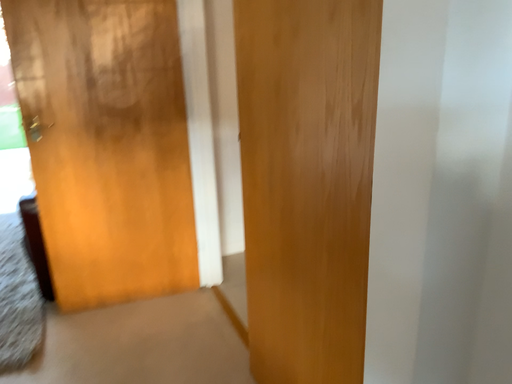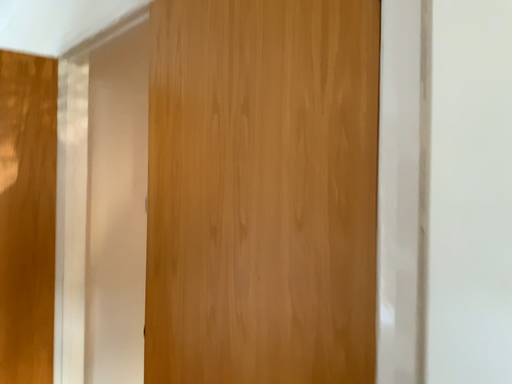
Question: How did the camera likely rotate when shooting the video?

Choices:
 (A) rotated upward
 (B) rotated downward

Answer: (A)